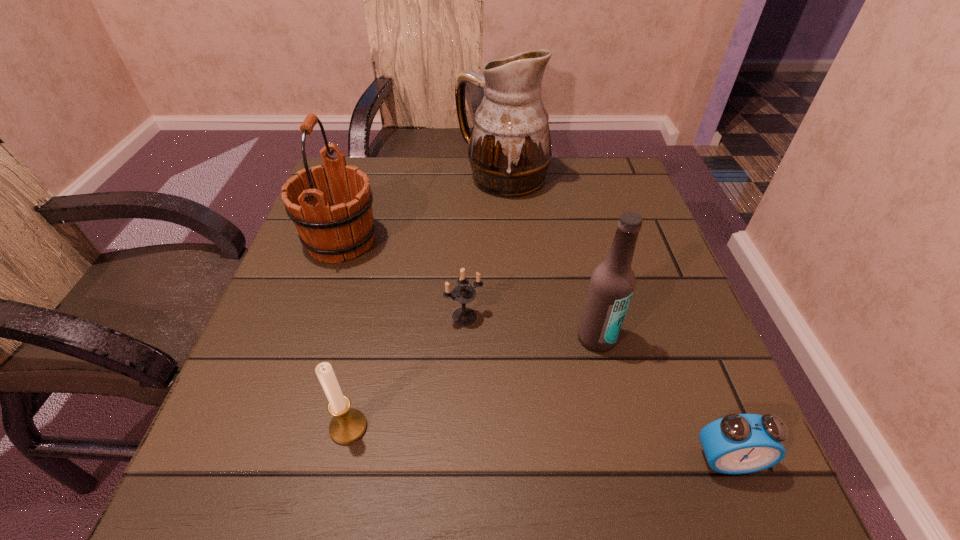
Identify the location of vacant space located from the spout of the farthest object. This screenshot has width=960, height=540. (366, 178).

The image size is (960, 540). Find the location of `vacant region located 0.210m on the back of the second farthest object`. vacant region located 0.210m on the back of the second farthest object is located at coordinates (366, 168).

Where is `vacant region located 0.220m on the label of the beer bottle`? This screenshot has width=960, height=540. vacant region located 0.220m on the label of the beer bottle is located at coordinates (630, 484).

Where is `free region located 0.070m on the back of the fourth tallest object`? The height and width of the screenshot is (540, 960). free region located 0.070m on the back of the fourth tallest object is located at coordinates (361, 372).

What are the coordinates of `free spot located on the front of the right candle holder` in the screenshot? It's located at (459, 482).

The width and height of the screenshot is (960, 540). Identify the location of object positioned at the far edge. (509, 151).

At what (x,y) coordinates should I click in order to perform the action: click on object that is at the near edge. Please return your answer as a coordinate pair (x, y). The image size is (960, 540). Looking at the image, I should click on (738, 443).

Identify the location of object present at the left edge. Image resolution: width=960 pixels, height=540 pixels. (330, 232).

Find the location of a particular element. beer bottle that is at the right edge is located at coordinates (612, 283).

Identify the location of alarm clock that is at the right edge. Image resolution: width=960 pixels, height=540 pixels. [x=738, y=443].